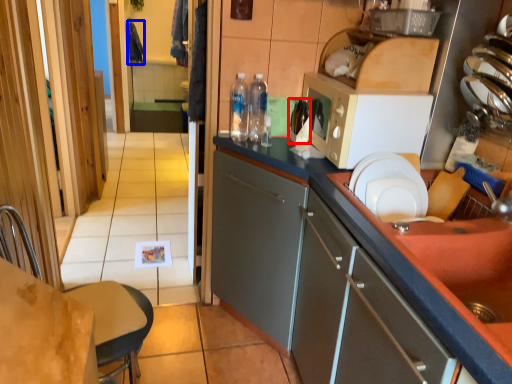
Question: Among these objects, which one is nearest to the camera, bottle (highlighted by a red box) or laundry (highlighted by a blue box)?

Choices:
 (A) bottle
 (B) laundry

Answer: (A)